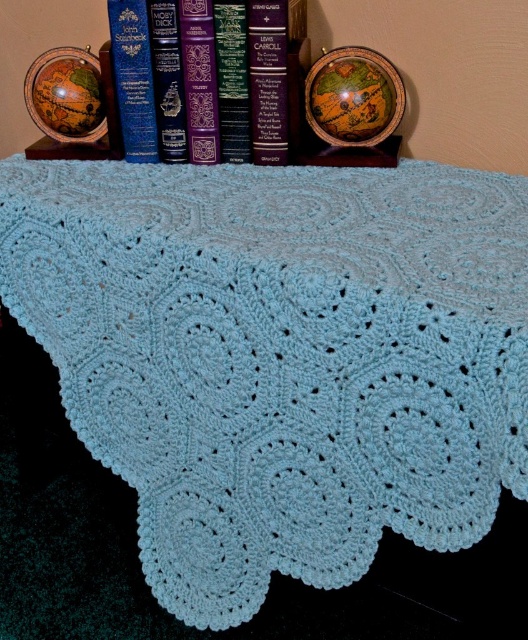
You are organizing a bookshelf and need to place the purple leather book at center and the hardcover book at center. Which book should you place first if you want to follow the rule of placing taller items first?

The purple leather book at center is much taller than the hardcover book at center, so you should place the purple leather book at center first to follow the rule of placing taller items first.

You are a librarian who needs to place a new book that is 2.5 inches thick. You see the purple leather book at center and the hardcover book at center. Can you fit the new book between them?

The purple leather book at center and the hardcover book at center are 2.72 inches apart. Since the new book is 2.5 inches thick, it can fit between them as the space is slightly larger than the book.